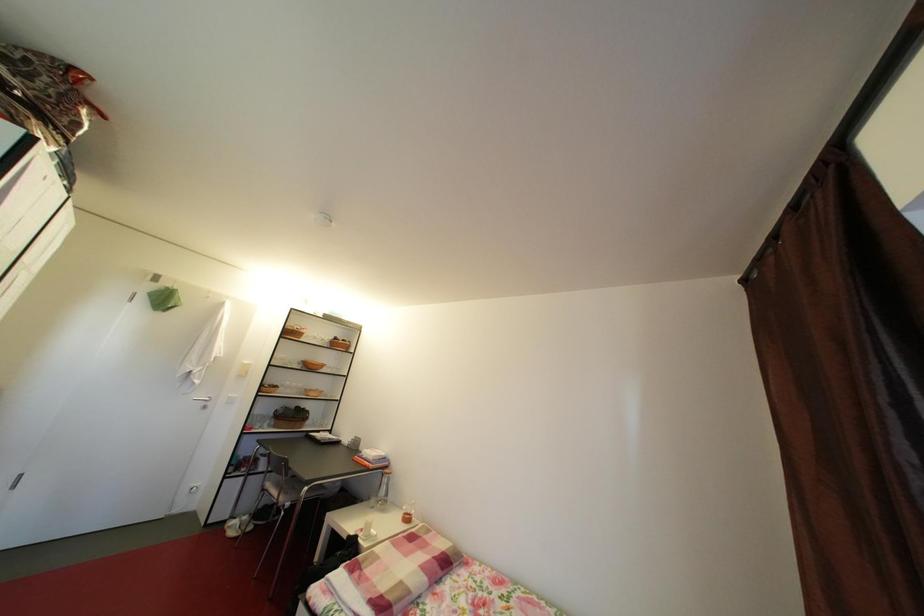
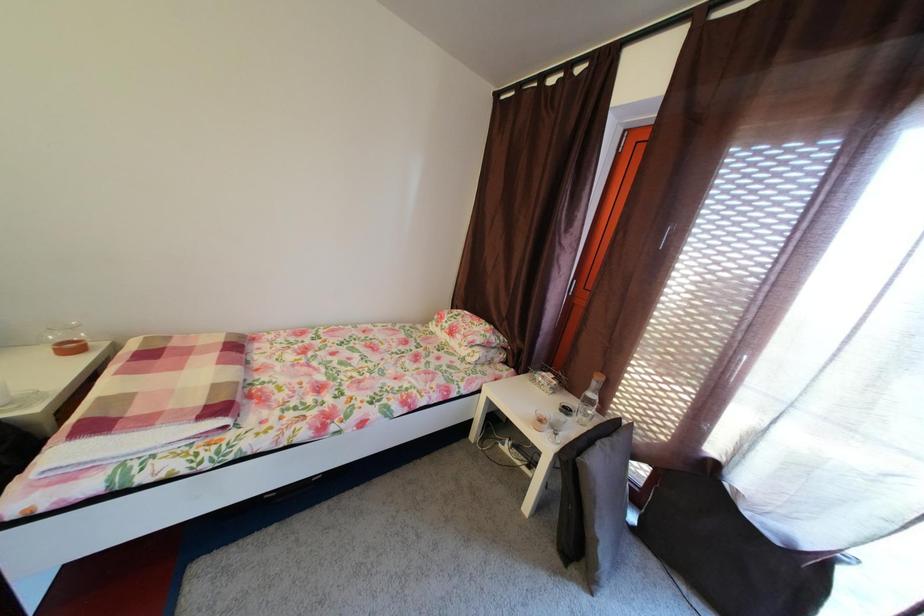
The first image is from the beginning of the video and the second image is from the end. How did the camera likely rotate when shooting the video?

The camera's rotation is toward right-down.